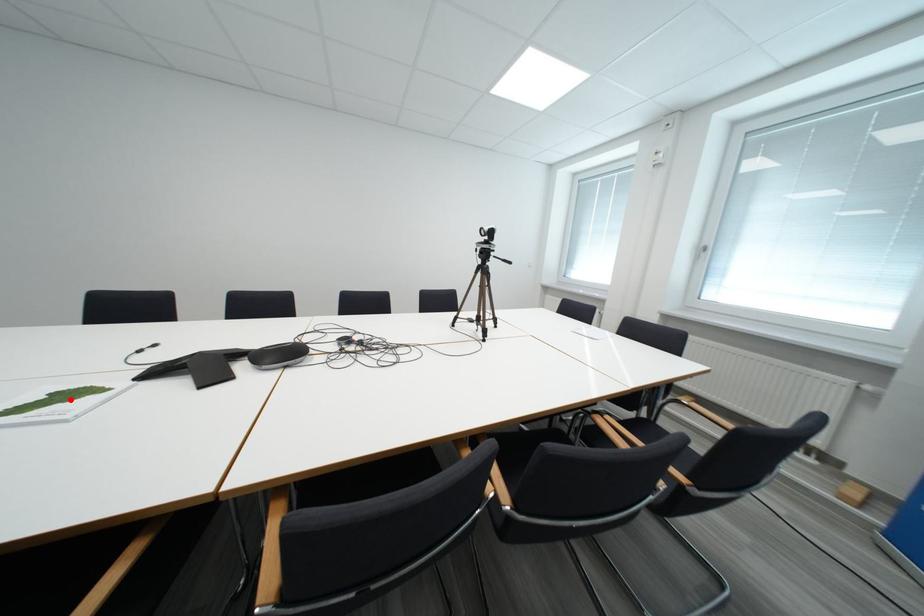
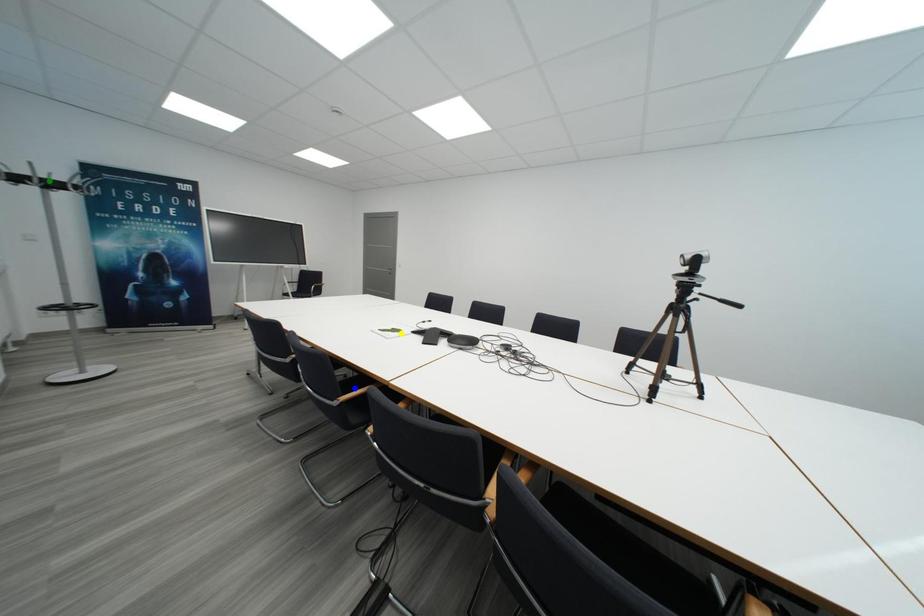
Question: I am providing you with two images of the same scene from different viewpoints. A red point is marked on the first image. You are given multiple points on the second image. In image 2, which mark is for the same physical point as the one in image 1?

Choices:
 (A) yellow point
 (B) blue point
 (C) green point

Answer: (A)